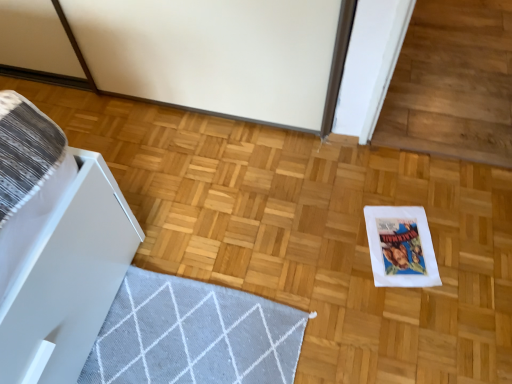
Describe the element at coordinates (401, 247) in the screenshot. I see `matte white comic book at lower right` at that location.

Locate an element on the screen. matte white comic book at lower right is located at coordinates (401, 247).

Identify the location of matte white comic book at lower right. The height and width of the screenshot is (384, 512). pyautogui.click(x=401, y=247).